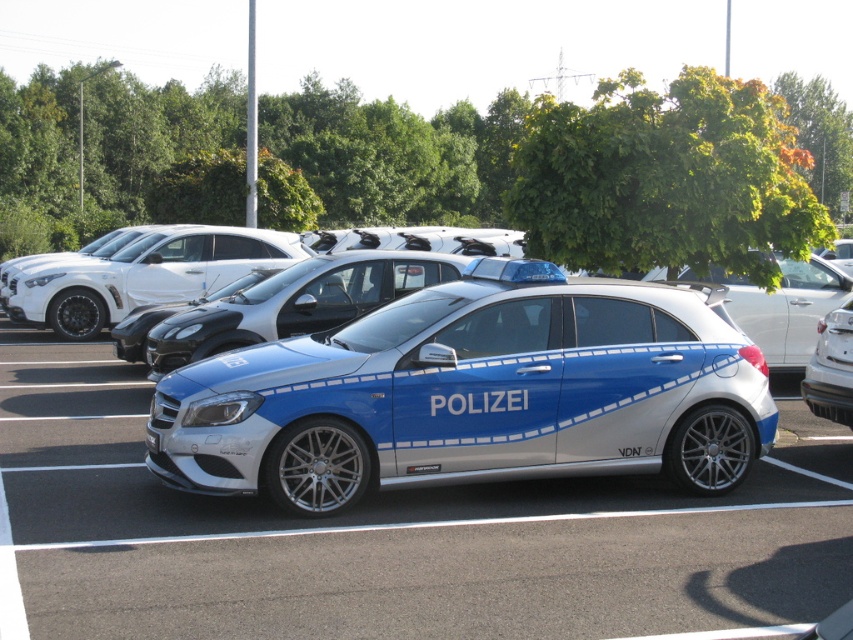
Question: Does metallic blue car at center appear on the left side of blue metallic car at center?

Choices:
 (A) no
 (B) yes

Answer: (A)

Question: Does white glossy sedan at center have a smaller size compared to satin silver car at center?

Choices:
 (A) no
 (B) yes

Answer: (A)

Question: Which object appears closest to the camera in this image?

Choices:
 (A) blue metallic police car at center
 (B) satin silver car at center
 (C) blue metallic car at center

Answer: (C)

Question: Does blue metallic car at center have a larger size compared to blue metallic police car at center?

Choices:
 (A) no
 (B) yes

Answer: (B)

Question: Among these points, which one is farthest from the camera?

Choices:
 (A) (537, 513)
 (B) (735, 289)

Answer: (B)

Question: Which is farther from the white glossy sedan at center?

Choices:
 (A) metallic blue car at center
 (B) black rubber line at lower center
 (C) blue metallic car at center
 (D) blue metallic police car at center

Answer: (B)